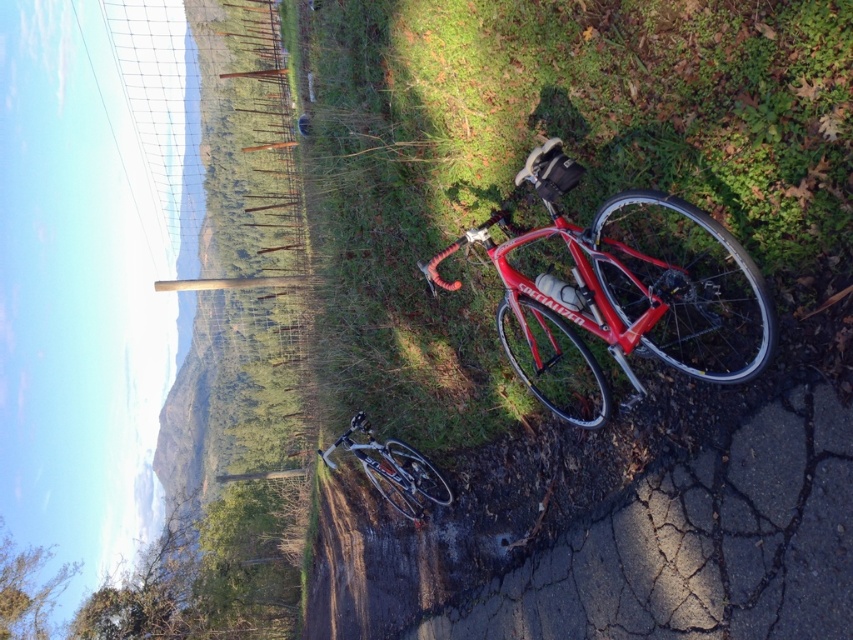
Describe the element at coordinates (573, 220) in the screenshot. The height and width of the screenshot is (640, 853). I see `green grass at center` at that location.

Between point (386, 257) and point (381, 445), which one is positioned behind?

Positioned behind is point (381, 445).

The width and height of the screenshot is (853, 640). I want to click on green grass at center, so click(x=573, y=220).

Can you confirm if green grass at center is positioned to the left of shiny red bicycle at center?

Indeed, green grass at center is positioned on the left side of shiny red bicycle at center.

Which is more to the left, green grass at center or shiny red bicycle at center?

green grass at center

Locate an element on the screen. The image size is (853, 640). green grass at center is located at coordinates (573, 220).

Can you confirm if shiny red bicycle at center is thinner than shiny silver bicycle at center?

Correct, shiny red bicycle at center's width is less than shiny silver bicycle at center's.

Which is below, shiny red bicycle at center or shiny silver bicycle at center?

Positioned lower is shiny silver bicycle at center.

Image resolution: width=853 pixels, height=640 pixels. What are the coordinates of `shiny red bicycle at center` in the screenshot? It's located at (622, 292).